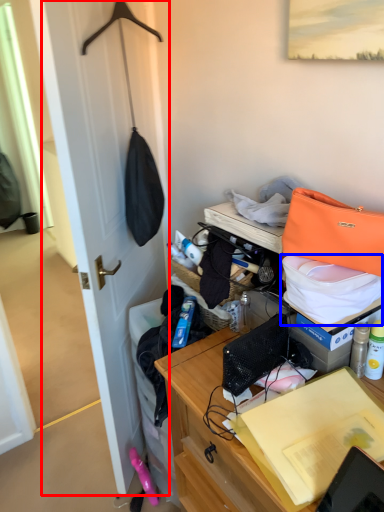
Question: Which object appears closest to the camera in this image, door (highlighted by a red box) or kit (highlighted by a blue box)?

Choices:
 (A) door
 (B) kit

Answer: (B)